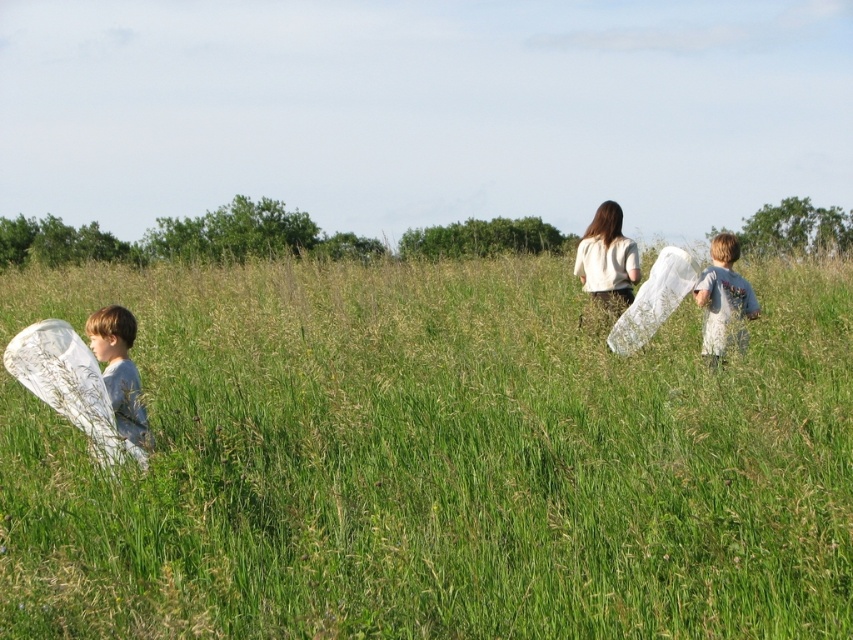
Question: Among these points, which one is farthest from the camera?

Choices:
 (A) 268,298
 (B) 119,317
 (C) 584,244

Answer: (A)

Question: From the image, what is the correct spatial relationship of light blue cotton shirt at left in relation to white cotton shirt at center?

Choices:
 (A) above
 (B) below

Answer: (B)

Question: Among these points, which one is nearest to the camera?

Choices:
 (A) (402, 394)
 (B) (123, 358)

Answer: (B)

Question: Which of the following is the closest to the observer?

Choices:
 (A) light blue t-shirt at right
 (B) light blue cotton shirt at left
 (C) white cotton shirt at center

Answer: (B)

Question: Is light blue cotton shirt at left above white cotton shirt at center?

Choices:
 (A) yes
 (B) no

Answer: (B)

Question: Can you confirm if light blue cotton shirt at left is wider than white cotton shirt at center?

Choices:
 (A) yes
 (B) no

Answer: (A)